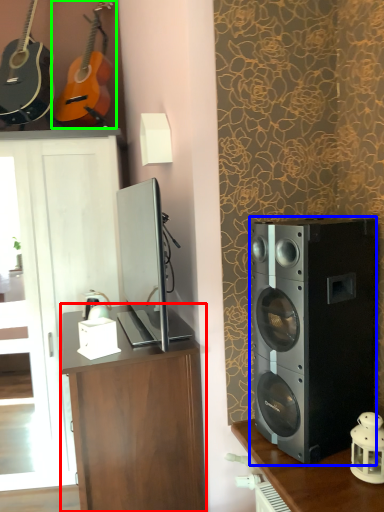
Question: Based on their relative distances, which object is nearer to desk (highlighted by a red box)? Choose from loudspeaker (highlighted by a blue box) and guitar (highlighted by a green box).

Choices:
 (A) loudspeaker
 (B) guitar

Answer: (A)